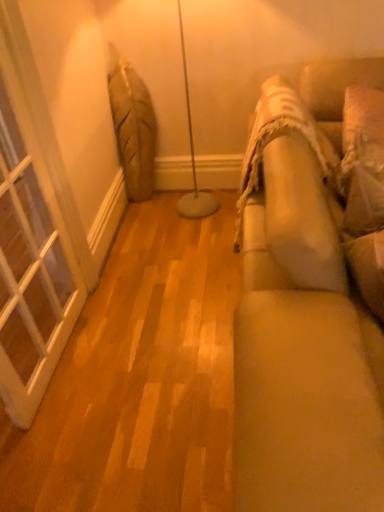
Question: Is white textured pillow at right shorter than beige fabric couch at right?

Choices:
 (A) no
 (B) yes

Answer: (B)

Question: Is white textured pillow at right to the left of beige fabric couch at right from the viewer's perspective?

Choices:
 (A) yes
 (B) no

Answer: (B)

Question: Is beige fabric couch at right completely or partially inside white textured pillow at right?

Choices:
 (A) no
 (B) yes

Answer: (A)

Question: Is white textured pillow at right positioned with its back to beige fabric couch at right?

Choices:
 (A) no
 (B) yes

Answer: (B)

Question: Is white textured pillow at right next to beige fabric couch at right?

Choices:
 (A) no
 (B) yes

Answer: (A)

Question: Based on their positions, is white textured pillow at right located to the left or right of white glass window at left?

Choices:
 (A) left
 (B) right

Answer: (B)

Question: Based on their sizes in the image, would you say white textured pillow at right is bigger or smaller than white glass window at left?

Choices:
 (A) big
 (B) small

Answer: (B)

Question: Is white textured pillow at right inside the boundaries of white glass window at left, or outside?

Choices:
 (A) outside
 (B) inside

Answer: (A)

Question: From the image's perspective, is white textured pillow at right above or below white glass window at left?

Choices:
 (A) below
 (B) above

Answer: (B)

Question: In the image, is beige fabric couch at right positioned in front of or behind white textured pillow at right?

Choices:
 (A) front
 (B) behind

Answer: (A)

Question: In terms of size, does beige fabric couch at right appear bigger or smaller than white textured pillow at right?

Choices:
 (A) small
 (B) big

Answer: (B)

Question: Which is correct: beige fabric couch at right is inside white textured pillow at right, or outside of it?

Choices:
 (A) outside
 (B) inside

Answer: (A)

Question: Is beige fabric couch at right taller or shorter than white textured pillow at right?

Choices:
 (A) tall
 (B) short

Answer: (A)

Question: Is white textured pillow at right situated inside beige fabric couch at right or outside?

Choices:
 (A) outside
 (B) inside

Answer: (B)

Question: Is point (360, 190) closer or farther from the camera than point (317, 286)?

Choices:
 (A) farther
 (B) closer

Answer: (A)